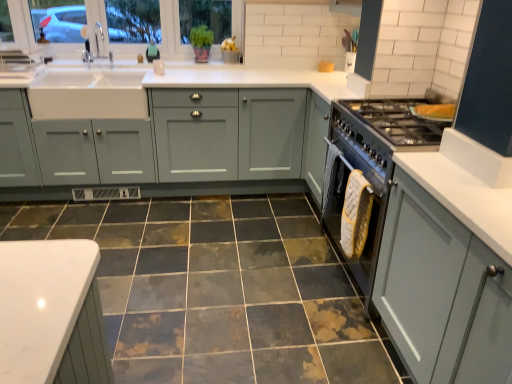
Question: Considering the relative sizes of marbled ceramic tile at center and matte gray cabinets at center, placed as the 1th cabinetry when sorted from top to bottom, in the image provided, is marbled ceramic tile at center shorter than matte gray cabinets at center, placed as the 1th cabinetry when sorted from top to bottom,?

Choices:
 (A) yes
 (B) no

Answer: (A)

Question: Does marbled ceramic tile at center have a smaller size compared to matte gray cabinets at center, placed as the 1th cabinetry when sorted from top to bottom?

Choices:
 (A) yes
 (B) no

Answer: (A)

Question: Can you see marbled ceramic tile at center touching matte gray cabinets at center, the 1th cabinetry viewed from the left?

Choices:
 (A) no
 (B) yes

Answer: (A)

Question: Is matte gray cabinets at center, the 1th cabinetry viewed from the back, at the back of marbled ceramic tile at center?

Choices:
 (A) no
 (B) yes

Answer: (A)

Question: Considering the relative positions of marbled ceramic tile at center and matte gray cabinets at center, arranged as the 2th cabinetry when viewed from the front, in the image provided, is marbled ceramic tile at center to the left of matte gray cabinets at center, arranged as the 2th cabinetry when viewed from the front, from the viewer's perspective?

Choices:
 (A) no
 (B) yes

Answer: (A)

Question: From the image's perspective, is marbled ceramic tile at center above matte gray cabinets at center, placed as the 1th cabinetry when sorted from top to bottom?

Choices:
 (A) yes
 (B) no

Answer: (B)

Question: From a real-world perspective, does matte gray cabinets at center, the 1th cabinetry viewed from the left, sit lower than clear glass window at upper left?

Choices:
 (A) yes
 (B) no

Answer: (A)

Question: Can you see matte gray cabinets at center, the 2th cabinetry when ordered from bottom to top, touching clear glass window at upper left?

Choices:
 (A) yes
 (B) no

Answer: (B)

Question: Is matte gray cabinets at center, the 2th cabinetry when ordered from bottom to top, behind clear glass window at upper left?

Choices:
 (A) yes
 (B) no

Answer: (B)

Question: Does matte gray cabinets at center, the 1th cabinetry viewed from the left, have a lesser width compared to clear glass window at upper left?

Choices:
 (A) yes
 (B) no

Answer: (B)

Question: Does matte gray cabinets at center, the 1th cabinetry viewed from the back, turn towards clear glass window at upper left?

Choices:
 (A) yes
 (B) no

Answer: (B)

Question: Does matte gray cabinets at center, which ranks as the second cabinetry in right-to-left order, have a lesser height compared to clear glass window at upper left?

Choices:
 (A) no
 (B) yes

Answer: (A)

Question: Considering the relative sizes of marbled ceramic tile at center and matte gray cabinet at right, the 1th cabinetry in the front-to-back sequence, in the image provided, is marbled ceramic tile at center thinner than matte gray cabinet at right, the 1th cabinetry in the front-to-back sequence,?

Choices:
 (A) no
 (B) yes

Answer: (A)